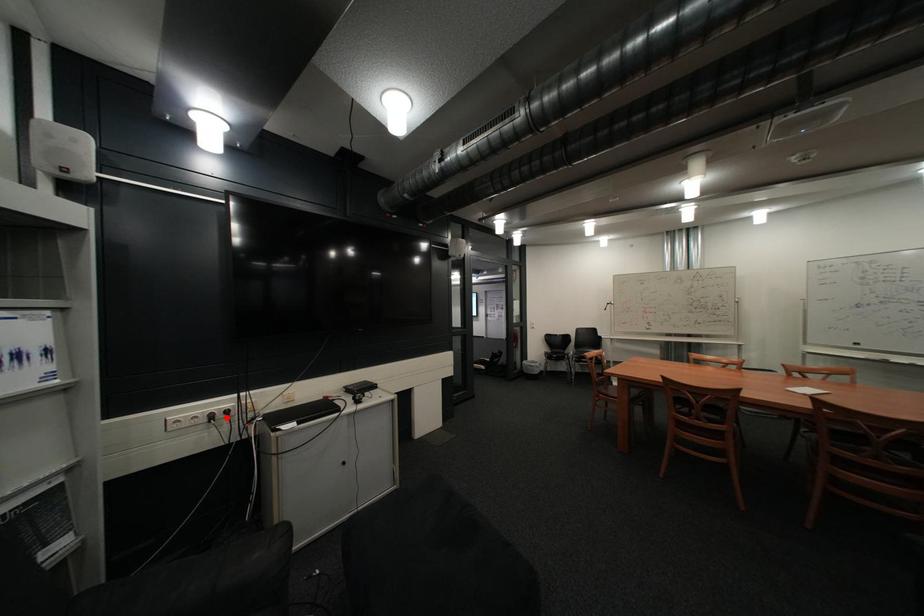
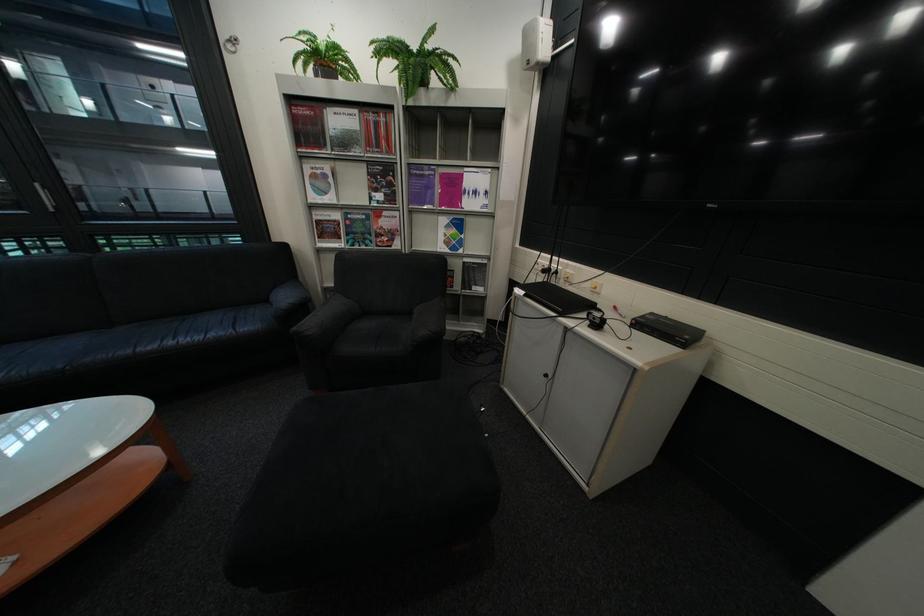
The point at the highlighted location is marked in the first image. Where is the corresponding point in the second image?

(563, 270)